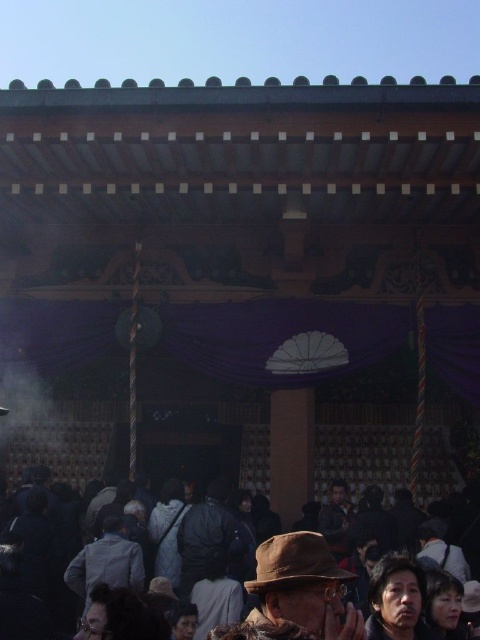
Between brown fabric hat at lower center and gray fabric jacket at lower left, which one appears on the left side from the viewer's perspective?

gray fabric jacket at lower left

Which is behind, point (324, 616) or point (91, 582)?

The point (91, 582) is more distant.

At what (x,y) coordinates should I click in order to perform the action: click on brown fabric hat at lower center. Please return your answer as a coordinate pair (x, y). The image size is (480, 640). Looking at the image, I should click on (302, 586).

Which of these two, brown fabric hat at lower center or dark gray fabric jacket at center, stands taller?

Standing taller between the two is brown fabric hat at lower center.

Between brown fabric hat at lower center and dark gray fabric jacket at center, which one is positioned higher?

Positioned higher is dark gray fabric jacket at center.

Between point (286, 595) and point (219, 477), which one is positioned in front?

Positioned in front is point (286, 595).

Identify the location of brown fabric hat at lower center. (302, 586).

Describe the element at coordinates (302, 586) in the screenshot. I see `dark brown fabric crowd at lower center` at that location.

Does point (307, 572) lie behind point (85, 579)?

That is False.

Is point (256, 557) positioned before point (122, 586)?

Yes, point (256, 557) is closer to viewer.

Locate an element on the screen. The width and height of the screenshot is (480, 640). dark brown fabric crowd at lower center is located at coordinates (302, 586).